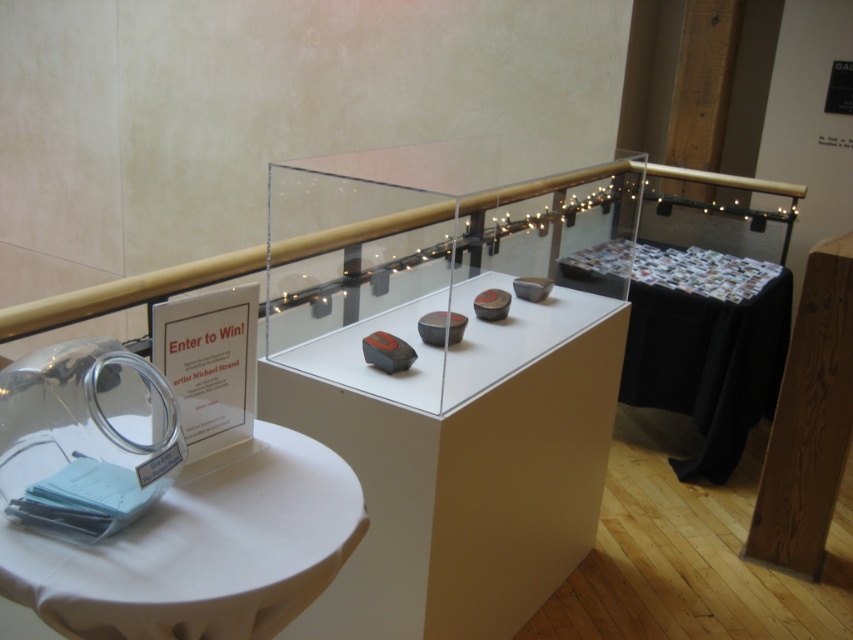
Consider the image. You are standing in the gallery and want to move from the entry forms table to the pedestal display. The entry forms table is located at point (677,252), and the pedestal display is at point (567,413). Which direction should you walk to reach the pedestal display from the entry forms table?

You should walk forward because point (567,413) is in front of point (677,252).